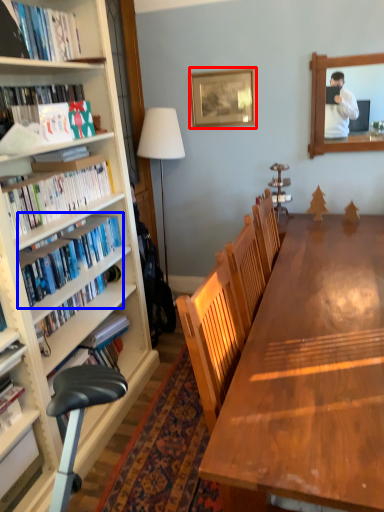
Question: Which point is closer to the camera, picture frame (highlighted by a red box) or book (highlighted by a blue box)?

Choices:
 (A) picture frame
 (B) book

Answer: (B)